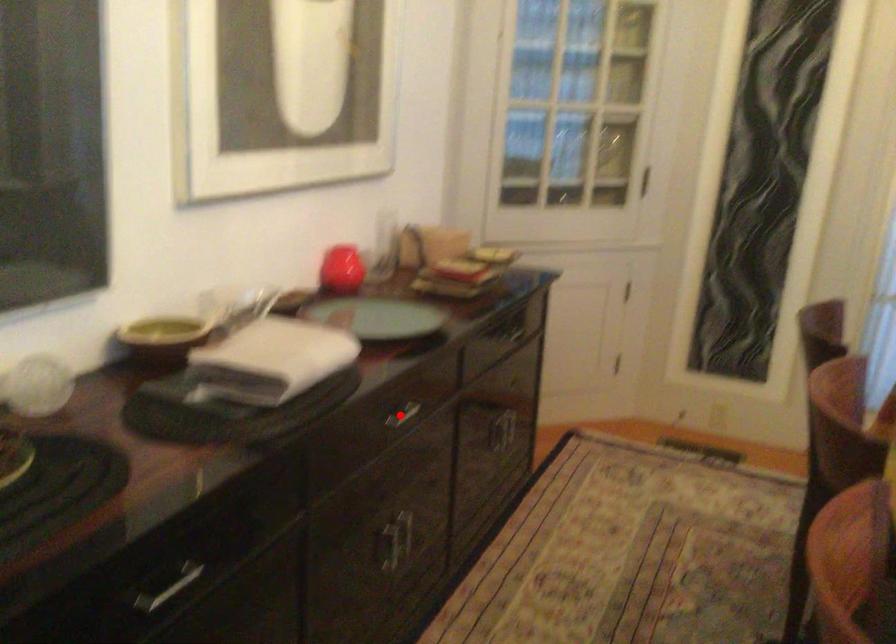
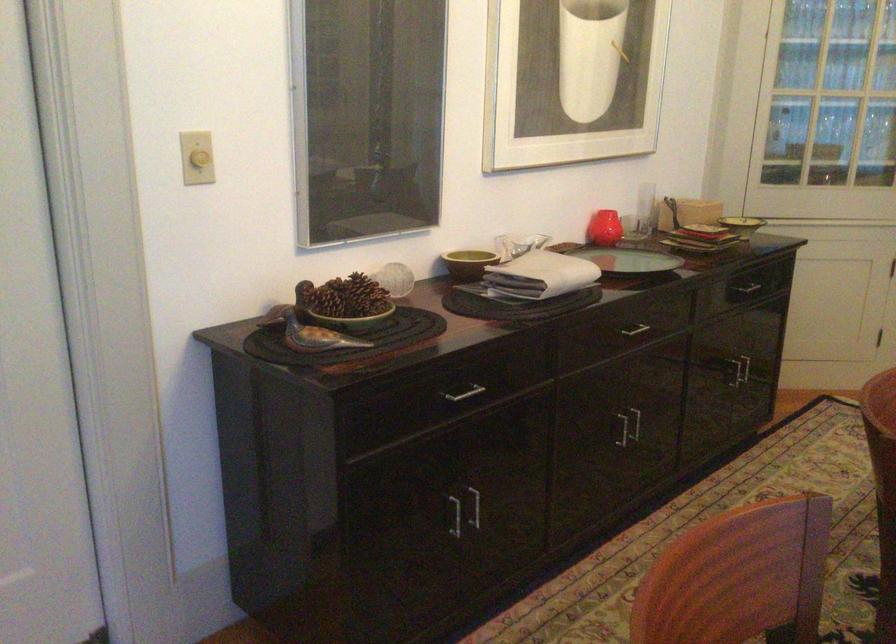
Question: I am providing you with two images of the same scene from different viewpoints. A red point is shown in image1. For the corresponding object point in image2, is it positioned nearer or farther from the camera?

Choices:
 (A) Nearer
 (B) Farther

Answer: (B)